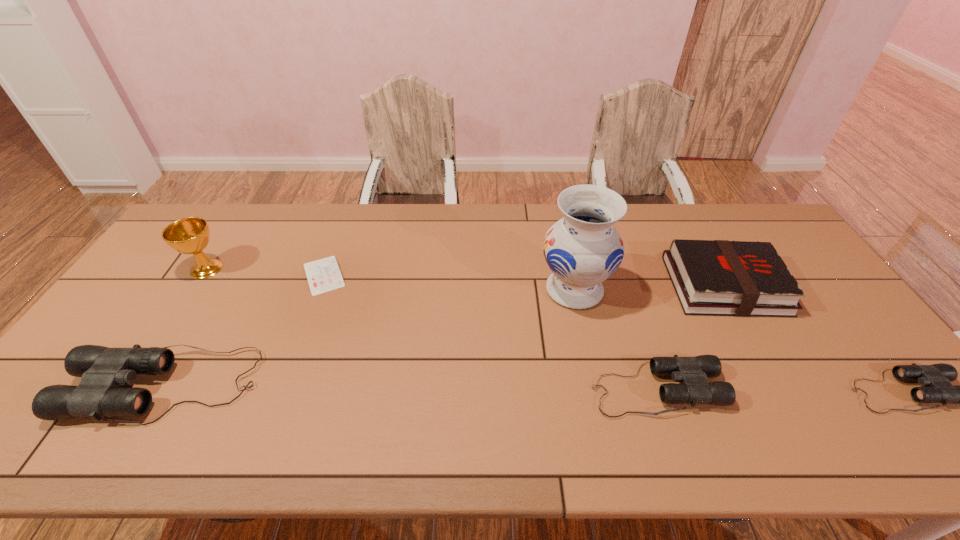
This screenshot has height=540, width=960. Find the location of `the tallest binoculars`. the tallest binoculars is located at coordinates (103, 370).

Locate an element on the screen. The image size is (960, 540). the second shortest binoculars is located at coordinates (692, 372).

The width and height of the screenshot is (960, 540). What are the coordinates of `the third shortest object` in the screenshot? It's located at (x=692, y=372).

Where is `chalice`? The height and width of the screenshot is (540, 960). chalice is located at coordinates (191, 235).

The image size is (960, 540). I want to click on hardback book, so click(711, 277).

Locate an element on the screen. This screenshot has width=960, height=540. vase is located at coordinates (583, 249).

Where is `diary`? The image size is (960, 540). diary is located at coordinates (323, 275).

You are a GUI agent. You are given a task and a screenshot of the screen. Output one action in this format:
    pyautogui.click(x=<x>, y=<y>)
    Task: Click on the free space located 0.390m at the eyepiece of the second binoculars from left to right
    This screenshot has width=960, height=540.
    Given the screenshot: What is the action you would take?
    pyautogui.click(x=880, y=390)

Find the location of `vacant region located 0.350m on the right of the chalice`. vacant region located 0.350m on the right of the chalice is located at coordinates [338, 268].

The width and height of the screenshot is (960, 540). Find the location of `vacant area located 0.220m on the front of the hardback book`. vacant area located 0.220m on the front of the hardback book is located at coordinates (780, 386).